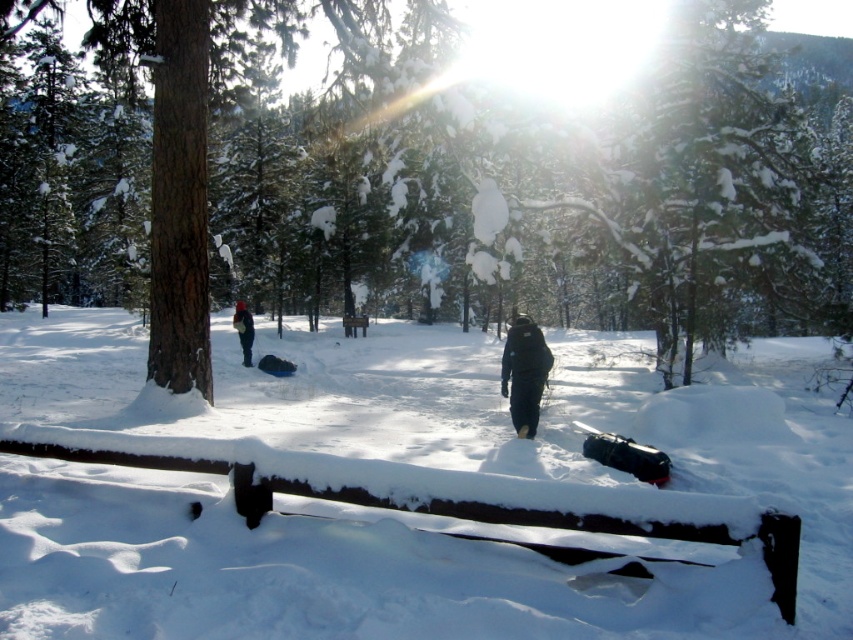
Consider the image. You are a hiker who wants to take a photo of the black matte jacket at center while standing behind the brown wood tree at center. Is this possible given their positions?

The brown wood tree at center is in front of the black matte jacket at center, so you cannot take a photo of the black matte jacket at center while standing behind the brown wood tree at center without the tree blocking the view.

You are planning to take a photo of the brown wood tree at center and the dark blue jacket at center in the winter scene. Which object appears wider in the image?

The brown wood tree at center appears wider than the dark blue jacket at center because its width surpasses the jacket.

You are planning to take a photo of the brown wood tree at center and the dark blue jacket at center from a distance. If your camera can focus on objects up to 100 feet away, will both subjects be in focus?

The brown wood tree at center is 87.79 feet away from the dark blue jacket at center. Since the camera can focus up to 100 feet, both subjects are within the focus range and will be in focus.